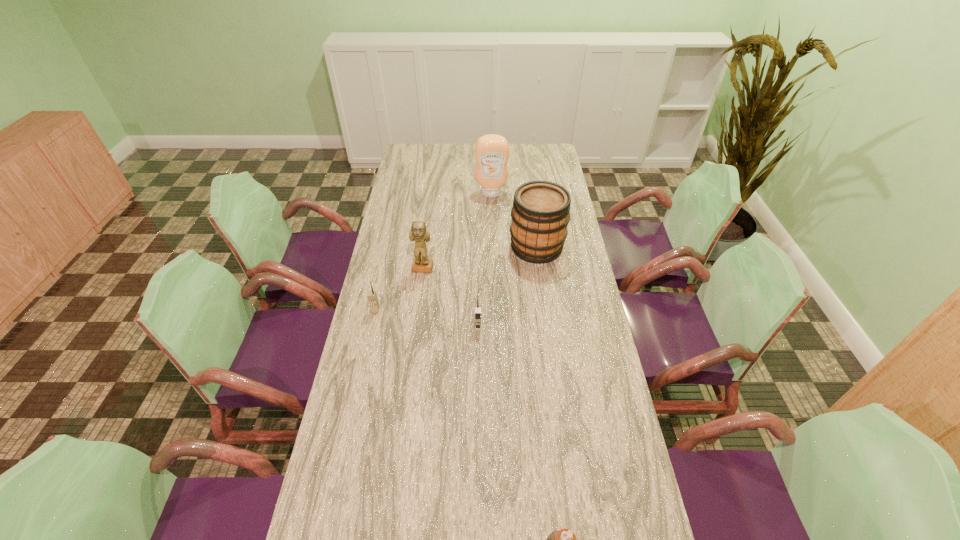
Identify the location of condiment. The image size is (960, 540). (491, 152).

The image size is (960, 540). Identify the location of cider. (540, 214).

Where is `the fifth object from right to left`? The width and height of the screenshot is (960, 540). the fifth object from right to left is located at coordinates (419, 233).

Where is `the leftmost object`? This screenshot has width=960, height=540. the leftmost object is located at coordinates (371, 295).

This screenshot has width=960, height=540. In order to click on the left cellular telephone in this screenshot , I will do `click(371, 295)`.

This screenshot has height=540, width=960. Find the location of `the nearer cellular telephone`. the nearer cellular telephone is located at coordinates (477, 308).

I want to click on the second nearest object, so click(x=477, y=308).

You are a GUI agent. You are given a task and a screenshot of the screen. Output one action in this format:
    pyautogui.click(x=<x>, y=<y>)
    Task: Click on the free region located on the label of the farthest object
    The width and height of the screenshot is (960, 540).
    Given the screenshot: What is the action you would take?
    pyautogui.click(x=492, y=214)

Where is `vacant space located 0.080m on the left of the cider`? The height and width of the screenshot is (540, 960). vacant space located 0.080m on the left of the cider is located at coordinates (489, 247).

I want to click on free spot located 0.400m on the front-facing side of the figurine, so click(410, 365).